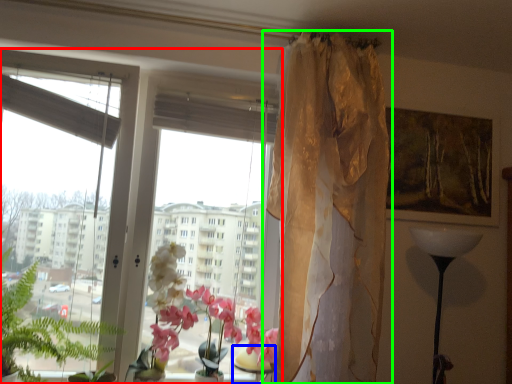
Question: Based on their relative distances, which object is nearer to window (highlighted by a red box)? Choose from table (highlighted by a blue box) and curtain (highlighted by a green box).

Choices:
 (A) table
 (B) curtain

Answer: (A)